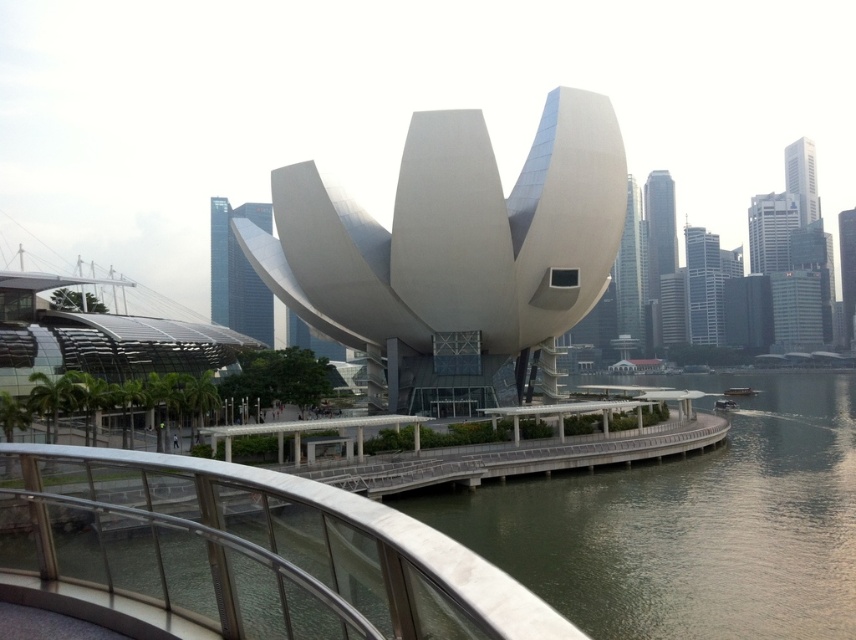
You are standing on the waterfront and want to cross to the other side. There are two bridges in view, the silver metallic bridge at lower center and the metallic gray bridge at center. Which bridge should you take if you want to reach the one closer to you?

You should take the silver metallic bridge at lower center because it is closer to the viewer than the metallic gray bridge at center.

You are standing at the curved walkway in the foreground of the image. You see a point marked at coordinates (455, 252). Based on the scene description, which object in the image does this point belong to?

The point at (455, 252) is on the white smooth building at center.

You are a city planner assessing the space between the white smooth building at center and the metallic gray bridge at center. Which structure occupies more area in the scene?

The white smooth building at center is larger in size than the metallic gray bridge at center, so it occupies more area in the scene.